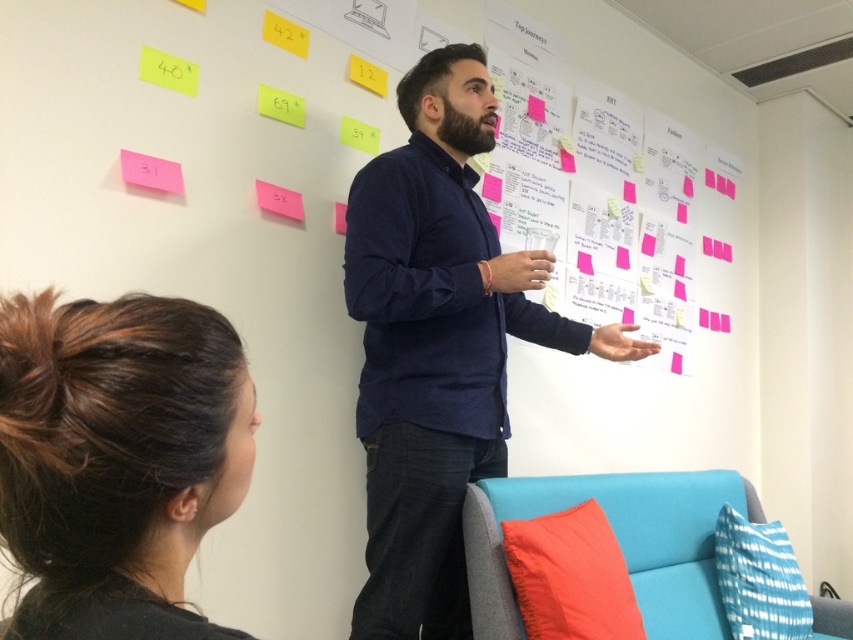
The height and width of the screenshot is (640, 853). Describe the element at coordinates (167, 70) in the screenshot. I see `yellow paper at upper left` at that location.

Is point (138, 67) behind point (263, 188)?

That is False.

Identify the location of yellow paper at upper left. This screenshot has width=853, height=640. (167, 70).

Does dark blue shirt at center have a smaller size compared to dark brown hair at lower left?

Incorrect, dark blue shirt at center is not smaller in size than dark brown hair at lower left.

This screenshot has width=853, height=640. I want to click on dark blue shirt at center, so click(x=438, y=344).

Does dark brown hair at lower left have a greater width compared to pink paper at upper center?

Correct, the width of dark brown hair at lower left exceeds that of pink paper at upper center.

Measure the distance between dark brown hair at lower left and camera.

The distance of dark brown hair at lower left from camera is 17.02 inches.

This screenshot has width=853, height=640. Identify the location of dark brown hair at lower left. (117, 460).